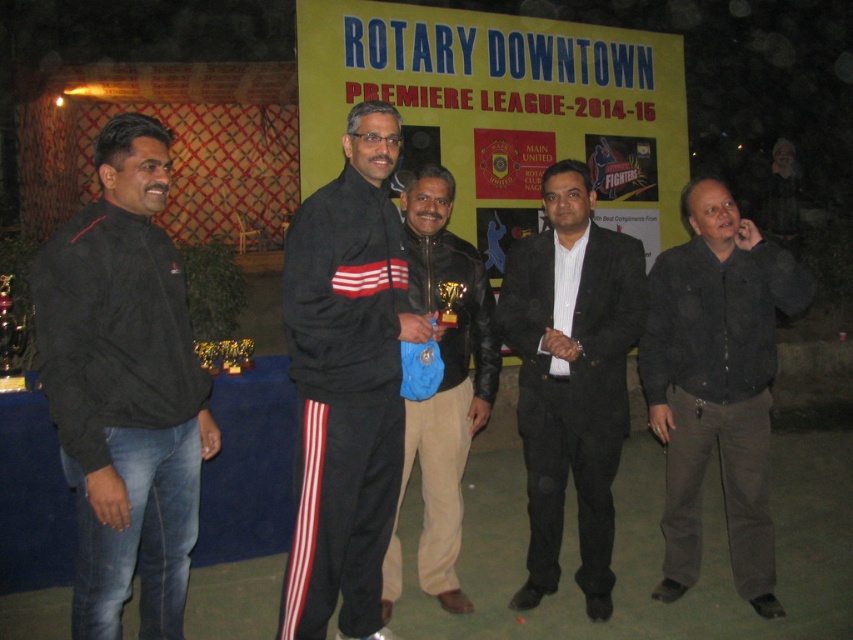
Which of these two, black matte jacket at left or black matte suit at center, stands taller?

black matte suit at center

Does point (96, 604) lie behind point (566, 392)?

That is False.

The height and width of the screenshot is (640, 853). I want to click on black matte jacket at left, so click(125, 387).

Does black matte jacket at left have a lesser width compared to black track suit at center?

Correct, black matte jacket at left's width is less than black track suit at center's.

Is black matte jacket at left shorter than black track suit at center?

Yes.

Who is more distant from viewer, (151, 166) or (308, 269)?

Positioned behind is point (308, 269).

This screenshot has width=853, height=640. I want to click on black matte jacket at left, so click(125, 387).

Can you confirm if dark gray shirt at right is wider than black matte suit at center?

Correct, the width of dark gray shirt at right exceeds that of black matte suit at center.

Between point (747, 436) and point (590, 225), which one is positioned in front?

Positioned in front is point (747, 436).

Find the location of a particular element. This screenshot has height=640, width=853. dark gray shirt at right is located at coordinates (717, 385).

The height and width of the screenshot is (640, 853). Find the location of `dark gray shirt at right`. dark gray shirt at right is located at coordinates (717, 385).